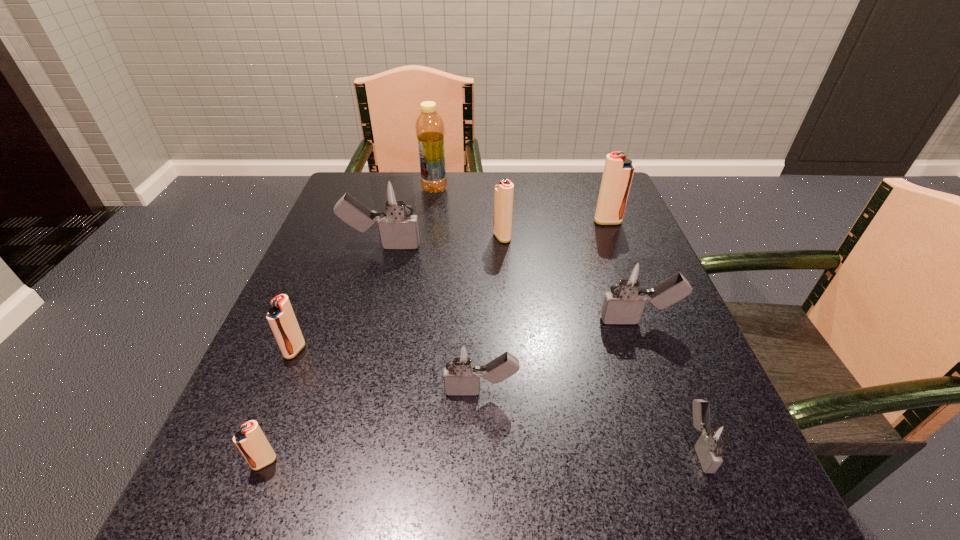
Where is `vacant space situated 0.290m on the back of the second biggest gray igniter`? The image size is (960, 540). vacant space situated 0.290m on the back of the second biggest gray igniter is located at coordinates (602, 222).

What are the coordinates of `free space located 0.130m on the right of the second gray igniter from left to right` in the screenshot? It's located at (598, 392).

At what (x,y) coordinates should I click in order to perform the action: click on vacant space positioned on the right of the fourth nearest igniter. Please return your answer as a coordinate pair (x, y). This screenshot has height=540, width=960. Looking at the image, I should click on (378, 350).

At what (x,y) coordinates should I click in order to perform the action: click on vacant space located on the right of the smallest red igniter. Please return your answer as a coordinate pair (x, y). The height and width of the screenshot is (540, 960). Looking at the image, I should click on (431, 462).

The height and width of the screenshot is (540, 960). Identify the location of free space located on the left of the nearest gray igniter. (495, 446).

The height and width of the screenshot is (540, 960). In order to click on bottle present at the far edge in this screenshot , I will do `click(430, 132)`.

Image resolution: width=960 pixels, height=540 pixels. I want to click on igniter at the far edge, so click(x=618, y=172).

You are a GUI agent. You are given a task and a screenshot of the screen. Output one action in this format:
    pyautogui.click(x=<x>, y=<y>)
    Task: Click on the object situated at the near edge
    The width and height of the screenshot is (960, 540).
    Given the screenshot: What is the action you would take?
    pyautogui.click(x=716, y=436)

Find the location of a particular element. object positioned at the far right corner is located at coordinates 618,172.

The height and width of the screenshot is (540, 960). In order to click on object present at the near right corner in this screenshot , I will do `click(716, 436)`.